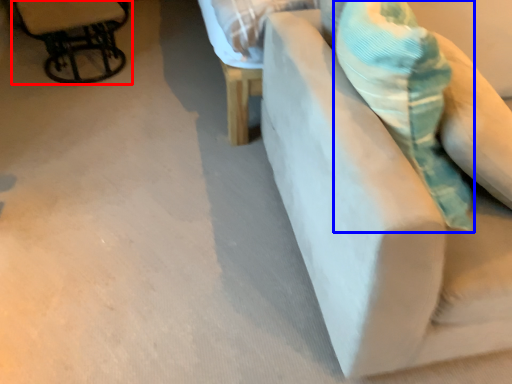
Question: Which object appears closest to the camera in this image, chair (highlighted by a red box) or throw pillow (highlighted by a blue box)?

Choices:
 (A) chair
 (B) throw pillow

Answer: (B)